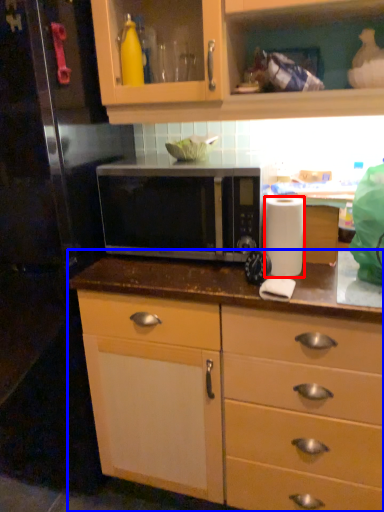
Question: Which object is closer to the camera taking this photo, paper towel (highlighted by a red box) or countertop (highlighted by a blue box)?

Choices:
 (A) paper towel
 (B) countertop

Answer: (B)